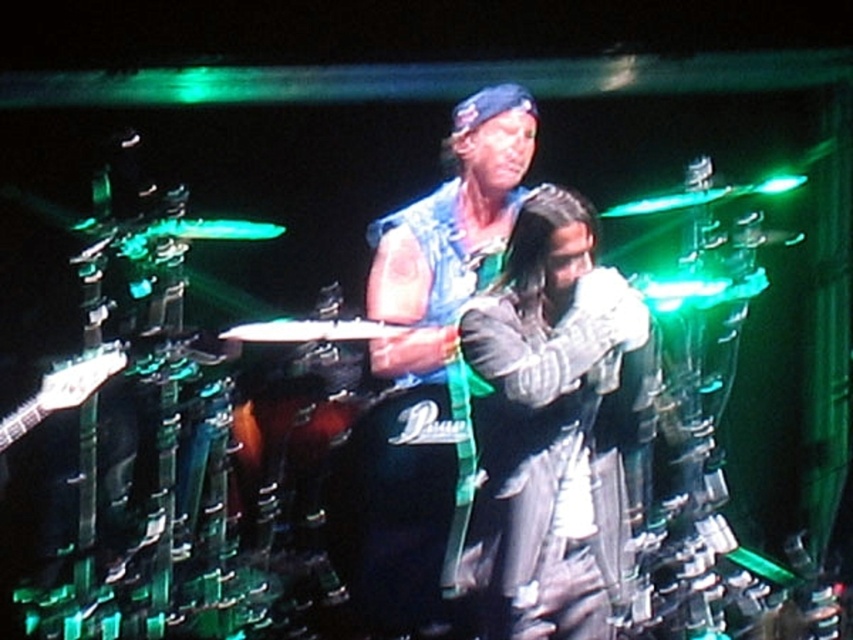
Question: Which object is positioned closest to the leather jacket at center?

Choices:
 (A) denim vest at center
 (B) black leather drum at center

Answer: (A)

Question: Does leather jacket at center appear under black leather drum at center?

Choices:
 (A) yes
 (B) no

Answer: (B)

Question: Is denim vest at center to the right of black leather drum at center from the viewer's perspective?

Choices:
 (A) yes
 (B) no

Answer: (A)

Question: Which point is closer to the camera?

Choices:
 (A) leather jacket at center
 (B) denim vest at center

Answer: (A)

Question: Which object is closer to the camera taking this photo?

Choices:
 (A) black leather drum at center
 (B) denim vest at center

Answer: (A)

Question: Does denim vest at center have a larger size compared to black leather drum at center?

Choices:
 (A) yes
 (B) no

Answer: (A)